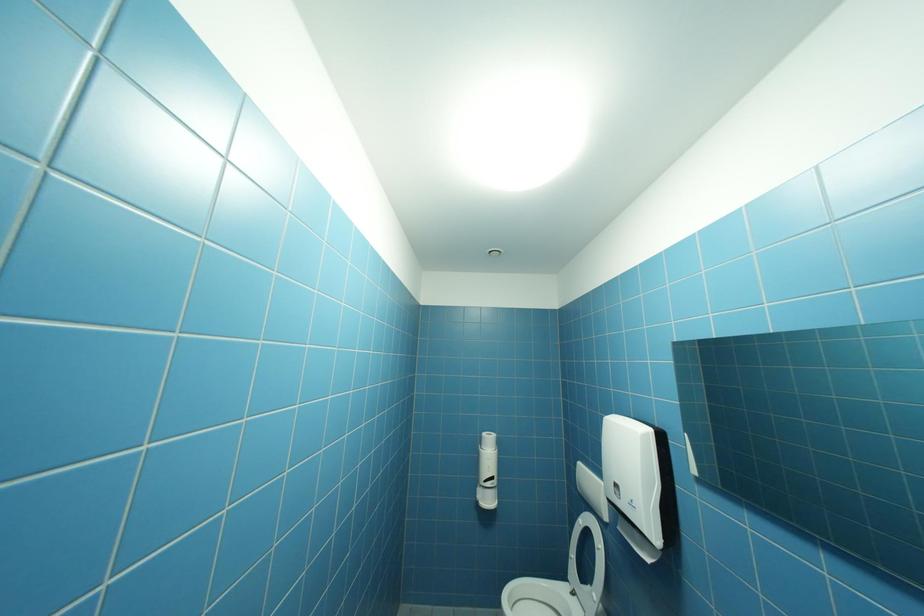
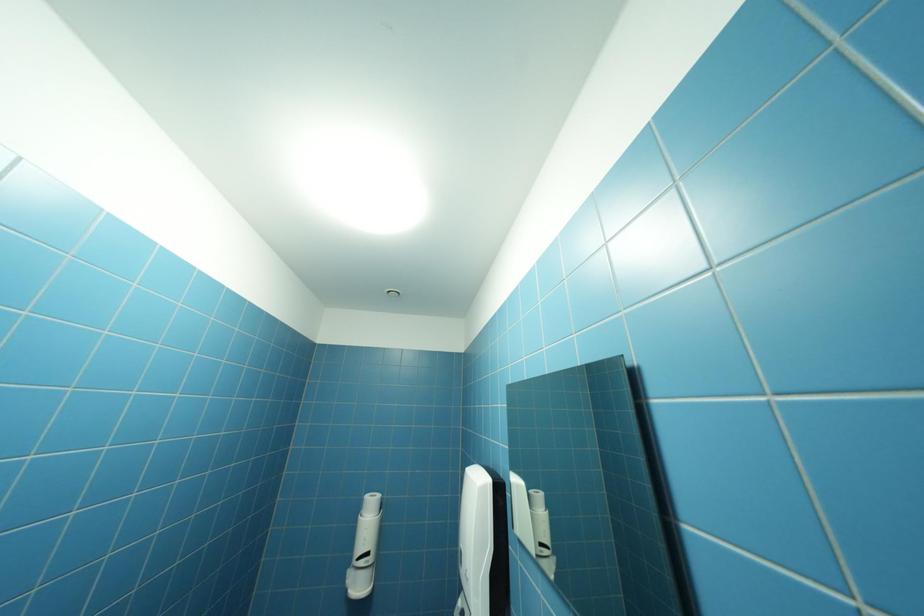
Question: Which direction would the cameraman need to move to produce the second image? Reply with the corresponding letter.

Choices:
 (A) Left
 (B) Right
 (C) Forward
 (D) Backward

Answer: (B)